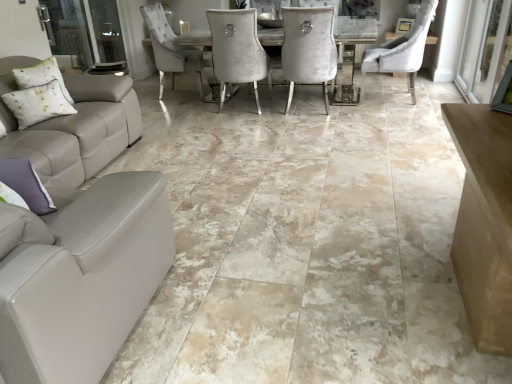
Where is `free point below velvet white chair at center, placed as the first chair when sorted from left to right (from a real-world perspective)`? This screenshot has width=512, height=384. free point below velvet white chair at center, placed as the first chair when sorted from left to right (from a real-world perspective) is located at coordinates (307, 108).